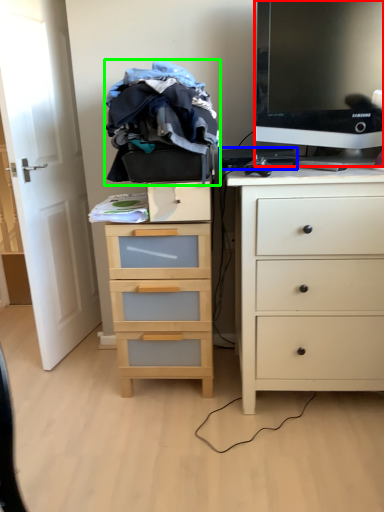
Question: Which object is the farthest from television (highlighted by a red box)? Choose among these: computer keyboard (highlighted by a blue box) or clothing (highlighted by a green box).

Choices:
 (A) computer keyboard
 (B) clothing

Answer: (B)